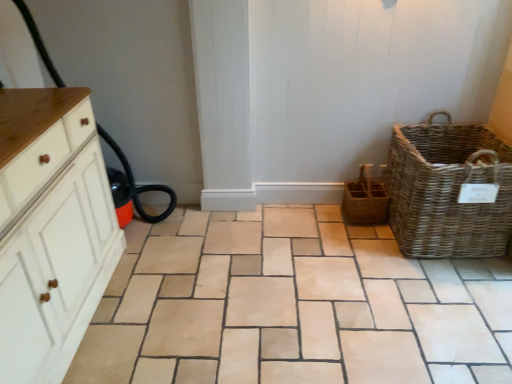
I want to click on vacant space situated on the left part of brown woven basket at center-right, so click(318, 221).